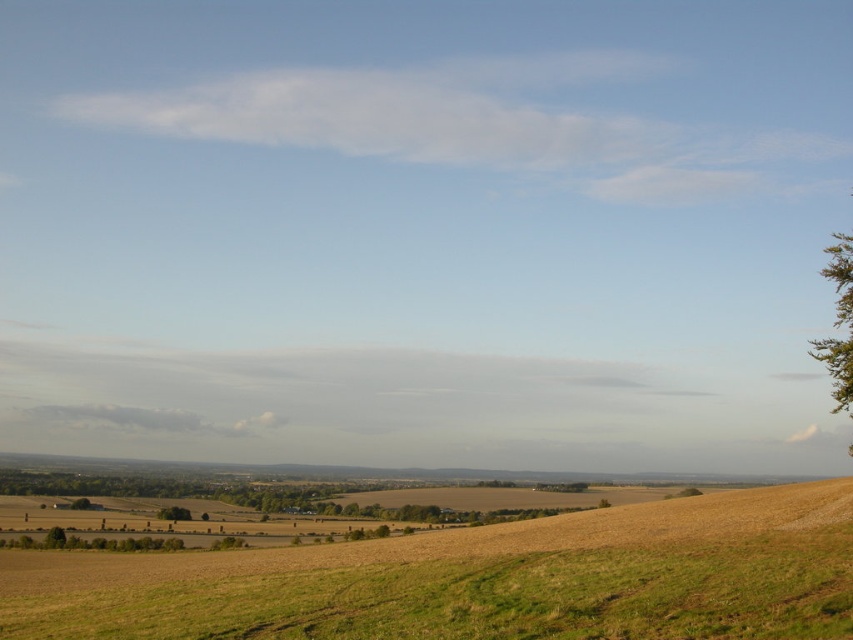
Question: Which object is farther from the camera taking this photo?

Choices:
 (A) green grassy field at lower center
 (B) green leafy tree at lower left

Answer: (B)

Question: Does green grassy field at lower center have a lesser width compared to green leafy tree at lower left?

Choices:
 (A) yes
 (B) no

Answer: (B)

Question: Does green grassy field at lower center appear over green leafy tree at lower left?

Choices:
 (A) yes
 (B) no

Answer: (A)

Question: Is green grassy field at lower center bigger than green leafy tree at lower left?

Choices:
 (A) no
 (B) yes

Answer: (B)